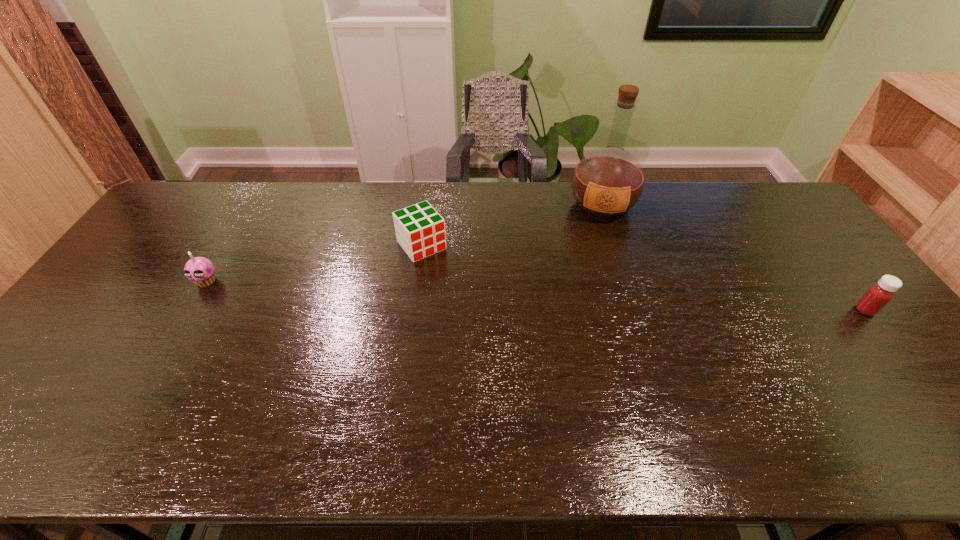
Where is `free space on the desktop that is between the cupcake and the rightmost object and is positioned on the front label of the third object from left to right`? This screenshot has width=960, height=540. free space on the desktop that is between the cupcake and the rightmost object and is positioned on the front label of the third object from left to right is located at coordinates (598, 298).

Find the location of `free spot on the desktop that is between the second nearest object and the rightmost object and is positioned on the red face of the third object from right to left`. free spot on the desktop that is between the second nearest object and the rightmost object and is positioned on the red face of the third object from right to left is located at coordinates (460, 292).